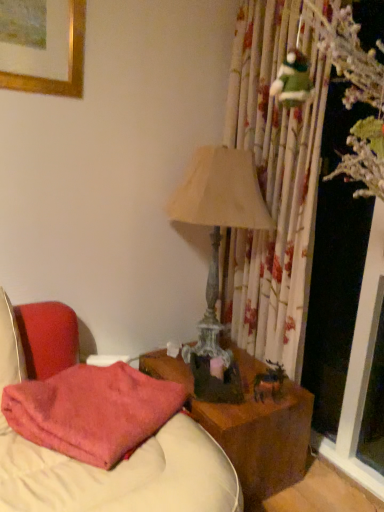
Question: Considering the relative sizes of wooden nightstand at center and matte beige lampshade at center-right in the image provided, is wooden nightstand at center bigger than matte beige lampshade at center-right?

Choices:
 (A) yes
 (B) no

Answer: (B)

Question: Does wooden nightstand at center have a greater height compared to matte beige lampshade at center-right?

Choices:
 (A) no
 (B) yes

Answer: (A)

Question: From a real-world perspective, is wooden nightstand at center beneath matte beige lampshade at center-right?

Choices:
 (A) no
 (B) yes

Answer: (B)

Question: Is wooden nightstand at center not within matte beige lampshade at center-right?

Choices:
 (A) no
 (B) yes

Answer: (B)

Question: Is wooden nightstand at center closer to the viewer compared to matte beige lampshade at center-right?

Choices:
 (A) no
 (B) yes

Answer: (B)

Question: From the image's perspective, is wooden nightstand at center above or below pink fuzzy pillow at lower left?

Choices:
 (A) below
 (B) above

Answer: (A)

Question: Is point (244, 438) positioned closer to the camera than point (61, 407)?

Choices:
 (A) closer
 (B) farther

Answer: (B)

Question: From a real-world perspective, is wooden nightstand at center above or below pink fuzzy pillow at lower left?

Choices:
 (A) above
 (B) below

Answer: (B)

Question: Considering the positions of wooden nightstand at center and pink fuzzy pillow at lower left in the image, is wooden nightstand at center bigger or smaller than pink fuzzy pillow at lower left?

Choices:
 (A) big
 (B) small

Answer: (A)

Question: From the image's perspective, is matte beige lampshade at center-right positioned above or below wooden nightstand at center?

Choices:
 (A) above
 (B) below

Answer: (A)

Question: From a real-world perspective, relative to wooden nightstand at center, is matte beige lampshade at center-right vertically above or below?

Choices:
 (A) below
 (B) above

Answer: (B)

Question: Considering the positions of matte beige lampshade at center-right and wooden nightstand at center in the image, is matte beige lampshade at center-right wider or thinner than wooden nightstand at center?

Choices:
 (A) thin
 (B) wide

Answer: (A)

Question: In the image, is matte beige lampshade at center-right on the left side or the right side of wooden nightstand at center?

Choices:
 (A) right
 (B) left

Answer: (B)

Question: Considering the positions of matte beige lampshade at center-right and pink fuzzy pillow at lower left in the image, is matte beige lampshade at center-right taller or shorter than pink fuzzy pillow at lower left?

Choices:
 (A) tall
 (B) short

Answer: (A)

Question: Considering the positions of matte beige lampshade at center-right and pink fuzzy pillow at lower left in the image, is matte beige lampshade at center-right bigger or smaller than pink fuzzy pillow at lower left?

Choices:
 (A) small
 (B) big

Answer: (B)